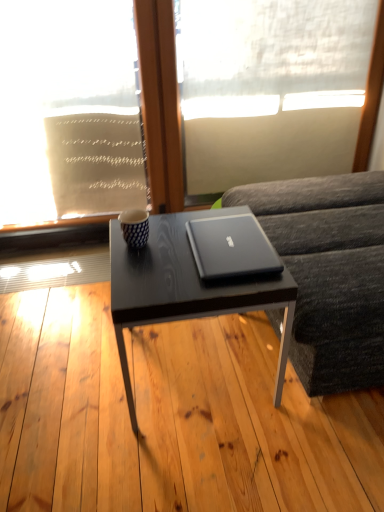
Question: Does white sheer fabric at upper center, the first window screen from the right, appear on the left side of white sheer fabric at upper left, acting as the 1th window screen starting from the left?

Choices:
 (A) yes
 (B) no

Answer: (B)

Question: Is white sheer fabric at upper center, marked as the 2th window screen in a left-to-right arrangement, positioned before white sheer fabric at upper left, acting as the 1th window screen starting from the left?

Choices:
 (A) yes
 (B) no

Answer: (B)

Question: From a real-world perspective, is white sheer fabric at upper center, the first window screen from the right, under white sheer fabric at upper left, acting as the 1th window screen starting from the left?

Choices:
 (A) yes
 (B) no

Answer: (B)

Question: Is white sheer fabric at upper center, the first window screen from the right, located outside white sheer fabric at upper left, the 2th window screen in the right-to-left sequence?

Choices:
 (A) no
 (B) yes

Answer: (B)

Question: Does white sheer fabric at upper center, the first window screen from the right, have a lesser width compared to white sheer fabric at upper left, acting as the 1th window screen starting from the left?

Choices:
 (A) yes
 (B) no

Answer: (B)

Question: In terms of width, does satin black laptop at center look wider or thinner when compared to white sheer fabric at upper left, the 2th window screen in the right-to-left sequence?

Choices:
 (A) thin
 (B) wide

Answer: (B)

Question: Do you think satin black laptop at center is within white sheer fabric at upper left, acting as the 1th window screen starting from the left, or outside of it?

Choices:
 (A) outside
 (B) inside

Answer: (A)

Question: From the image's perspective, is satin black laptop at center above or below white sheer fabric at upper left, acting as the 1th window screen starting from the left?

Choices:
 (A) above
 (B) below

Answer: (B)

Question: Based on their sizes in the image, would you say satin black laptop at center is bigger or smaller than white sheer fabric at upper left, acting as the 1th window screen starting from the left?

Choices:
 (A) big
 (B) small

Answer: (B)

Question: Is dark gray fabric couch at right wider or thinner than white sheer fabric at upper center, marked as the 2th window screen in a left-to-right arrangement?

Choices:
 (A) thin
 (B) wide

Answer: (B)

Question: From a real-world perspective, is dark gray fabric couch at right above or below white sheer fabric at upper center, the first window screen from the right?

Choices:
 (A) above
 (B) below

Answer: (B)

Question: From the image's perspective, is dark gray fabric couch at right above or below white sheer fabric at upper center, the first window screen from the right?

Choices:
 (A) above
 (B) below

Answer: (B)

Question: Relative to white sheer fabric at upper center, the first window screen from the right, is dark gray fabric couch at right in front or behind?

Choices:
 (A) front
 (B) behind

Answer: (A)

Question: Is white sheer fabric at upper left, the 2th window screen in the right-to-left sequence, taller or shorter than satin black laptop at center?

Choices:
 (A) tall
 (B) short

Answer: (A)

Question: From the image's perspective, is white sheer fabric at upper left, the 2th window screen in the right-to-left sequence, above or below satin black laptop at center?

Choices:
 (A) above
 (B) below

Answer: (A)